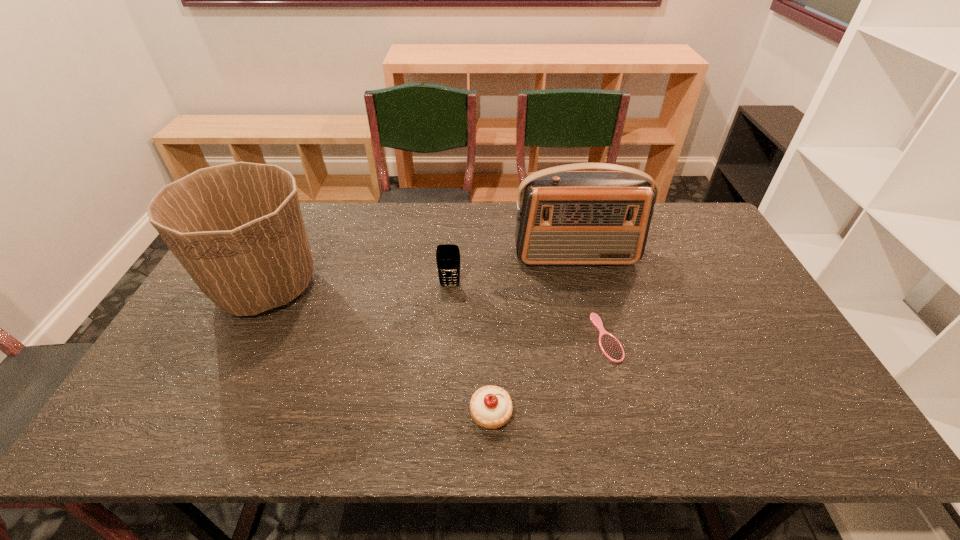
Locate an element on the screen. The height and width of the screenshot is (540, 960). free space that satisfies the following two spatial constraints: 1. on the front-facing side of the shortest object; 2. on the left side of the radio receiver is located at coordinates (596, 338).

Image resolution: width=960 pixels, height=540 pixels. I want to click on blank space that satisfies the following two spatial constraints: 1. on the screen of the second shortest object; 2. on the left side of the fourth object from right to left, so (x=441, y=413).

You are a GUI agent. You are given a task and a screenshot of the screen. Output one action in this format:
    pyautogui.click(x=<x>, y=<y>)
    Task: Click on the free space that satisfies the following two spatial constraints: 1. on the screen of the nearest object; 2. on the right side of the second object from left to right
    This screenshot has height=540, width=960.
    Given the screenshot: What is the action you would take?
    pyautogui.click(x=441, y=413)